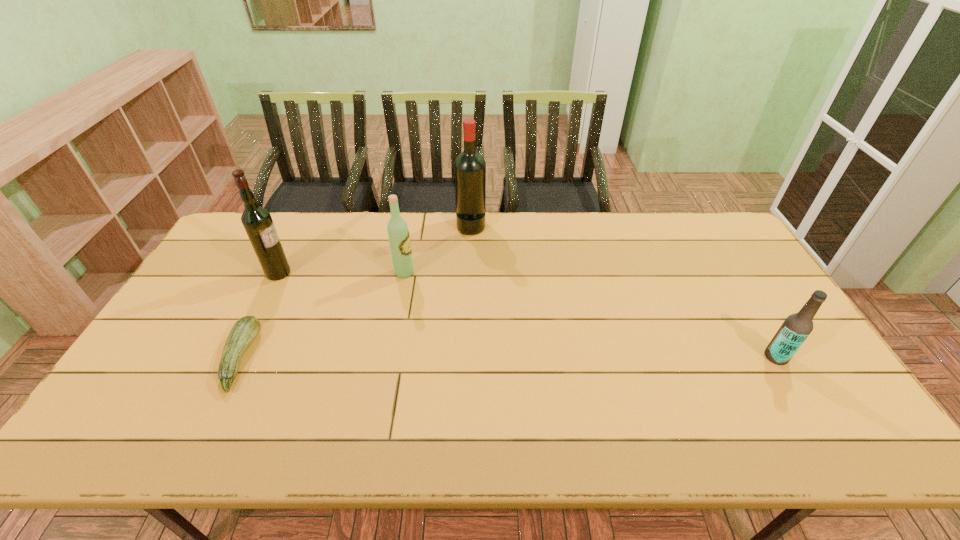
Identify the location of vacant area situated on the front-facing side of the third object from left to right. The width and height of the screenshot is (960, 540). (536, 273).

Where is `vacant space located on the side of the rightmost object with the label`? vacant space located on the side of the rightmost object with the label is located at coordinates (697, 357).

Locate an element on the screen. vacant space located 0.080m on the side of the rightmost object with the label is located at coordinates [734, 357].

Find the location of `vacant space located on the side of the rightmost object with the label`. vacant space located on the side of the rightmost object with the label is located at coordinates (697, 357).

At what (x,y) coordinates should I click in order to perform the action: click on vacant space located 0.100m at the stem end of the zucchini. Please return your answer as a coordinate pair (x, y). The width and height of the screenshot is (960, 540). Looking at the image, I should click on (290, 359).

Locate an element on the screen. The image size is (960, 540). object that is at the far edge is located at coordinates point(469,167).

Find the location of a particular element. The height and width of the screenshot is (540, 960). object that is at the right edge is located at coordinates (795, 329).

You are a GUI agent. You are given a task and a screenshot of the screen. Output one action in this format:
    pyautogui.click(x=<x>, y=<y>)
    Task: Click on the vacant region at the far edge of the desktop
    
    Given the screenshot: What is the action you would take?
    pyautogui.click(x=602, y=218)

In the image, there is a desktop. Identify the location of vacant space at the near edge. (265, 439).

The height and width of the screenshot is (540, 960). In the image, there is a desktop. Identify the location of vacant space at the left edge. (131, 384).